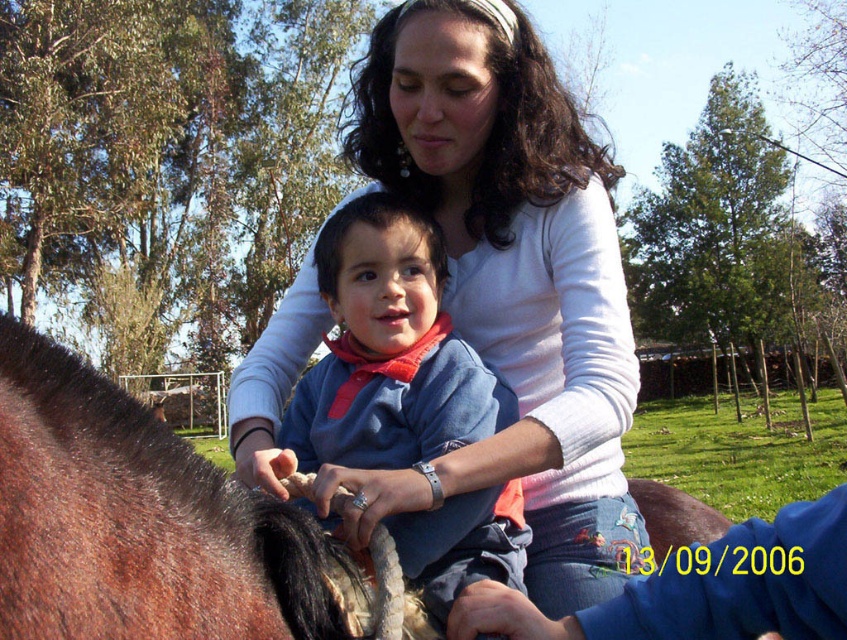
Which is more to the right, brown fuzzy horse at left or blue cotton shirt at center?

blue cotton shirt at center

Is brown fuzzy horse at left shorter than blue cotton shirt at center?

Yes, brown fuzzy horse at left is shorter than blue cotton shirt at center.

Does point (147, 426) come farther from viewer compared to point (446, 444)?

No.

Where is `brown fuzzy horse at left`? The image size is (847, 640). brown fuzzy horse at left is located at coordinates (136, 520).

Is white matte shirt at center to the left of blue cotton shirt at center from the viewer's perspective?

In fact, white matte shirt at center is to the right of blue cotton shirt at center.

Can you confirm if white matte shirt at center is positioned above blue cotton shirt at center?

Yes.

Describe the element at coordinates (510, 282) in the screenshot. I see `white matte shirt at center` at that location.

Image resolution: width=847 pixels, height=640 pixels. I want to click on white matte shirt at center, so click(x=510, y=282).

This screenshot has width=847, height=640. I want to click on white matte shirt at center, so click(510, 282).

Is white matte shirt at center thinner than brown fuzzy horse at left?

No.

Is point (602, 449) more distant than point (136, 625)?

Yes, it is behind point (136, 625).

Locate an element on the screen. This screenshot has height=640, width=847. white matte shirt at center is located at coordinates (510, 282).